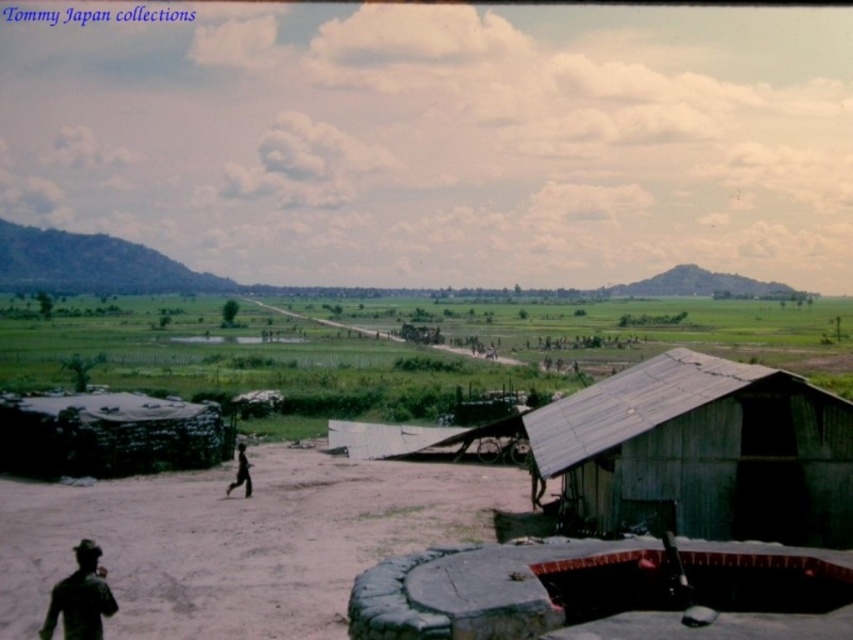
You are a photographer trying to capture a photo of the black matte figure at center and the dark green uniform at lower left. Based on their heights, which one should you focus on first to ensure both are in frame without adjusting your camera angle?

Since the dark green uniform at lower left is shorter than the black matte figure at center, you should focus on the black matte figure at center first to ensure both are in frame without adjusting your camera angle.